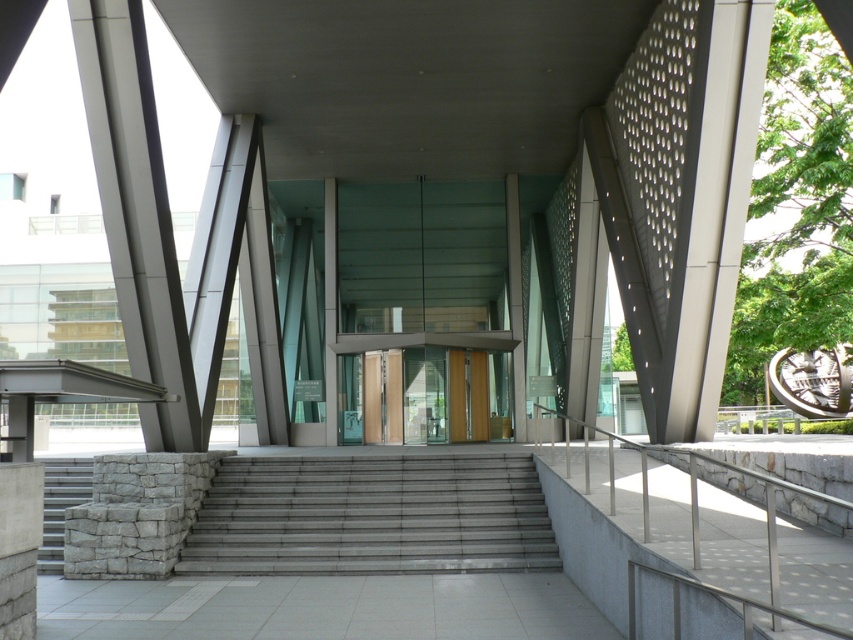
Question: Which is farther from the translucent glass doors at center?

Choices:
 (A) gray stone stairs at lower left
 (B) gray concrete stairs at center

Answer: (A)

Question: Based on their relative distances, which object is nearer to the translucent glass doors at center?

Choices:
 (A) metallic gray pillar at left
 (B) satin silver railing at right
 (C) gray concrete stairs at center

Answer: (C)

Question: Is gray concrete stairs at center bigger than gray stone stairs at lower left?

Choices:
 (A) no
 (B) yes

Answer: (B)

Question: Does satin silver railing at right appear under gray stone stairs at lower left?

Choices:
 (A) no
 (B) yes

Answer: (A)

Question: Can you confirm if satin silver railing at right is smaller than metallic gray pillar at left?

Choices:
 (A) yes
 (B) no

Answer: (A)

Question: Considering the real-world distances, which object is farthest from the gray concrete stairs at center?

Choices:
 (A) satin silver railing at right
 (B) metallic gray pillar at left
 (C) translucent glass doors at center
 (D) gray stone stairs at lower left

Answer: (A)